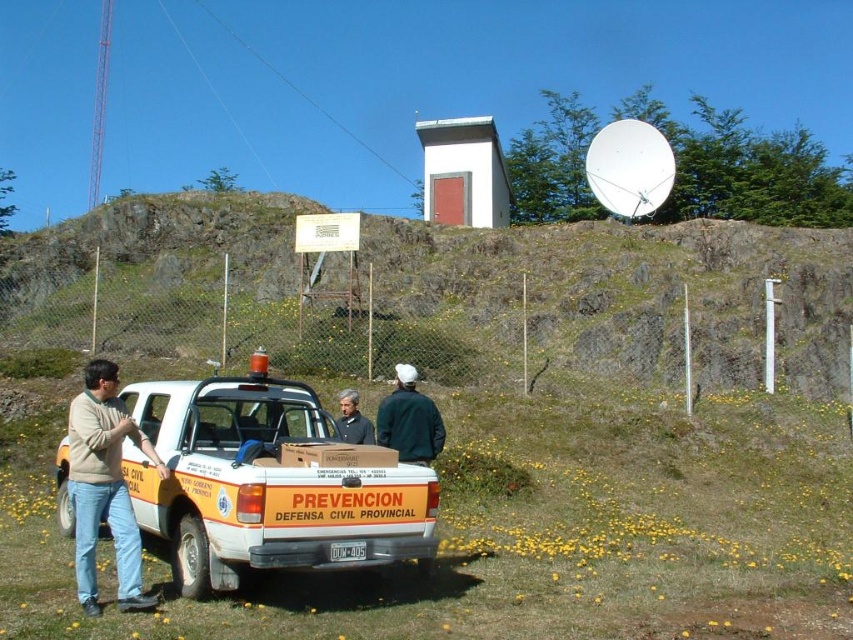
You are standing in front of the white pickup truck and want to place a small flag at the point closer to you between point (218, 534) and point (136, 589). Which point should you choose?

Point (218, 534) is closer to the viewer than point (136, 589), so you should choose point (218, 534) to place the flag.

You are a hiker trying to determine which object in the scene is bigger. You see the rocky terrain at upper center and the light brown sweater at left. Based on the scene, which one is larger?

The rocky terrain at upper center is larger than the light brown sweater at left.

You are a delivery person who needs to load a heavy package onto the white matte pickup truck at center. However, there is a light brown sweater at left in the way. Can you move the sweater to access the truck?

The white matte pickup truck at center is positioned under the light brown sweater at left, meaning the sweater is blocking access to the truck. You will need to move the sweater to load the package onto the truck.